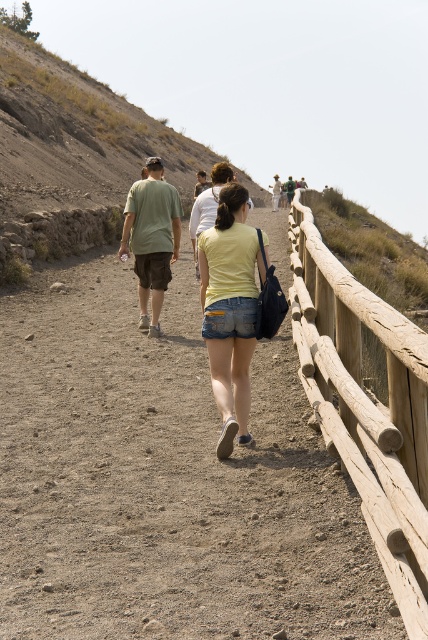
Which is in front, point (175, 179) or point (303, 182)?

Point (175, 179) is in front.

Which is above, dull brown dirt at upper left or white cotton shirt at center?

white cotton shirt at center

Image resolution: width=428 pixels, height=640 pixels. I want to click on dull brown dirt at upper left, so click(x=74, y=154).

Does point (323, 413) lie in front of point (241, 378)?

Yes.

Identify the location of wooden at right. This screenshot has height=640, width=428. (366, 404).

Who is more distant from viewer, (x=365, y=307) or (x=222, y=403)?

Positioned behind is point (x=222, y=403).

The image size is (428, 640). In order to click on wooden at right in this screenshot , I will do `click(366, 404)`.

Who is more forward, (107, 179) or (252, 344)?

Point (252, 344)

Does point (205, 157) lie behind point (258, 250)?

Yes.

Locate an element on the screen. Image resolution: width=428 pixels, height=640 pixels. dull brown dirt at upper left is located at coordinates (74, 154).